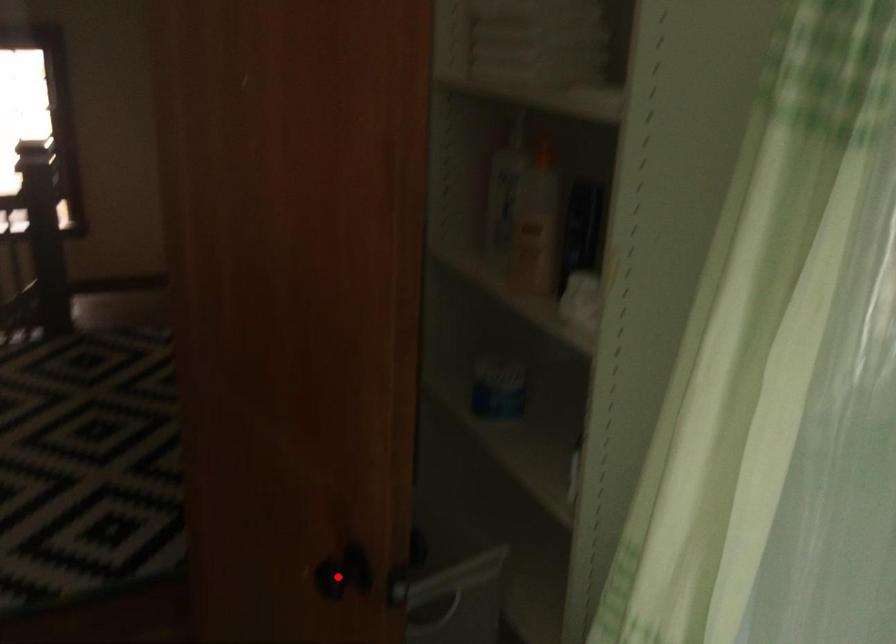
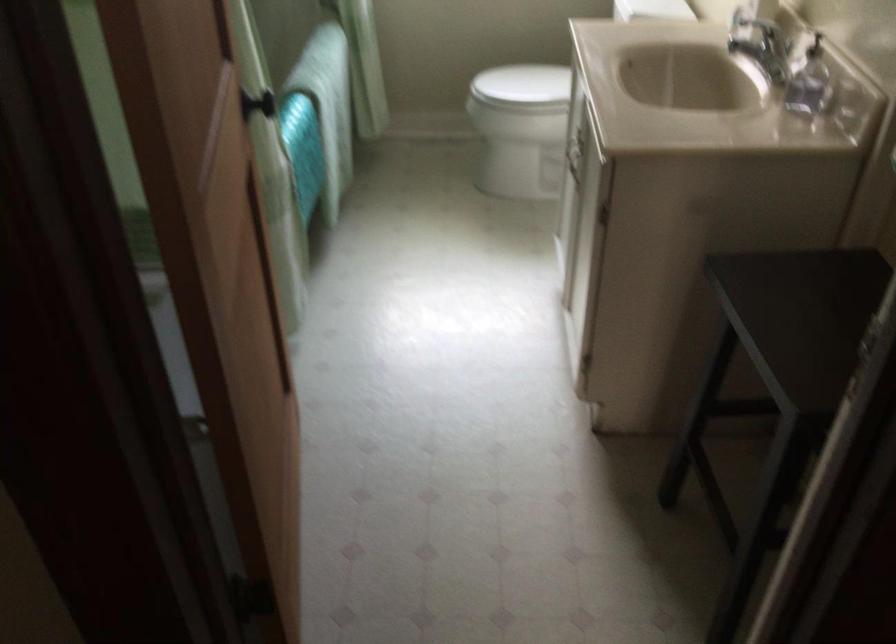
Question: I am providing you with two images of the same scene from different viewpoints. A red point is marked on the first image. Can you still see the location of the red point in image 2?

Choices:
 (A) Yes
 (B) No

Answer: (B)